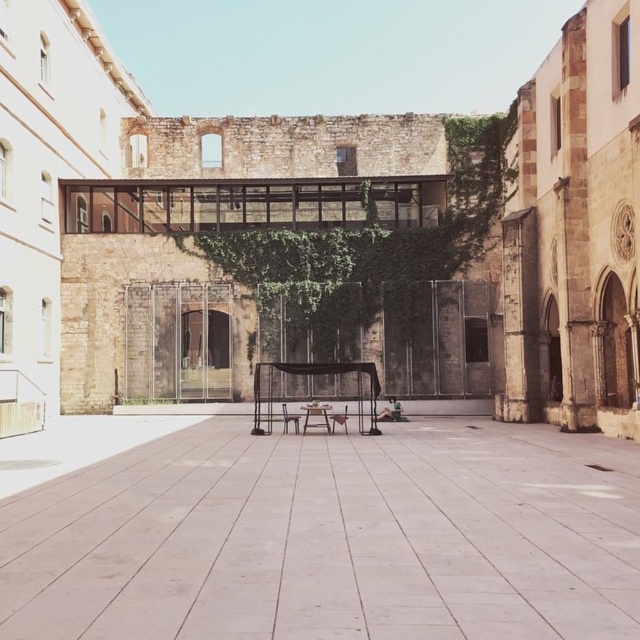
You are standing in the courtyard and want to walk to the white concrete alley at center. There is a wooden park bench at center in your path. Which direction should you move to avoid the bench and reach the alley?

The white concrete alley at center is in front of the wooden park bench at center, so you can walk straight ahead towards the alley without needing to move around the bench.

You are standing in the courtyard and want to walk from the modern glass and steel bridge on the left to the temporary black tarp structure in the center. Which point, point [112,548] or point [282,422], is closer to your starting position?

Point [112,548] is closer to the viewer than point [282,422], so it is closer to your starting position.

You are a painter standing in the courtyard and want to place an easel between the white concrete alley at center and the wooden park bench at center. Which object should you place the easel closer to if you want the easel to be more visible from above?

The easel should be placed closer to the wooden park bench at center because it has a greater height than the white concrete alley at center, making it more visible from above.